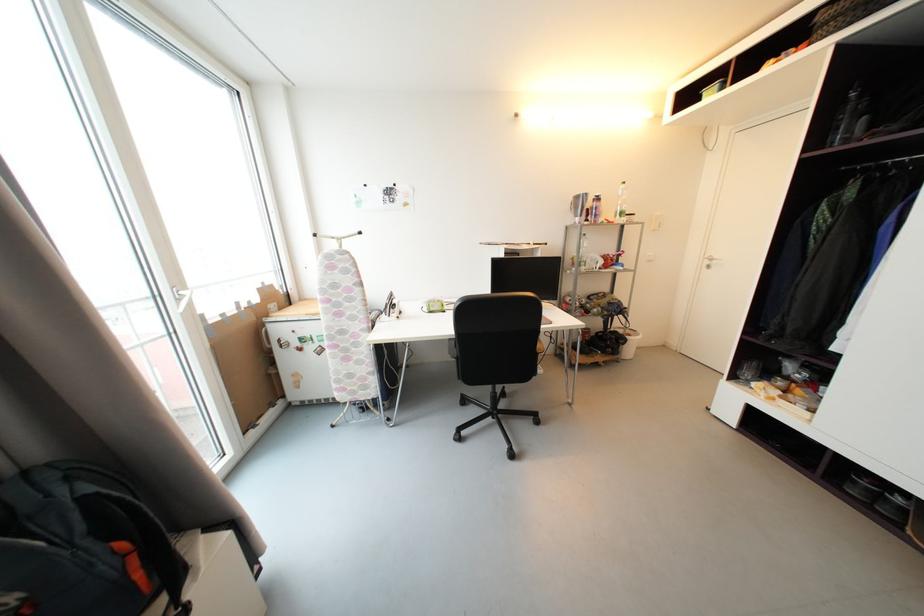
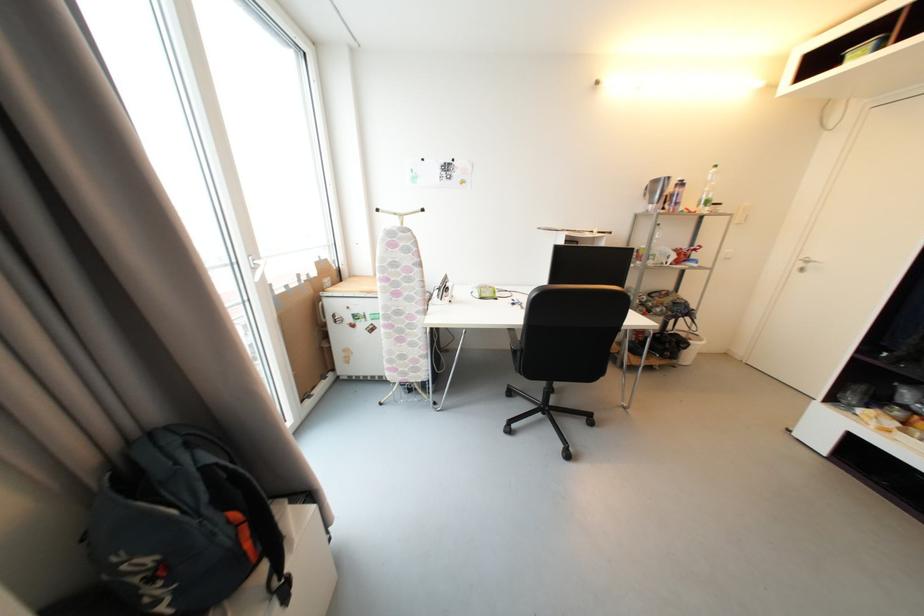
Where in the second image is the point corresponding to pixel 274 328 from the first image?

(330, 302)